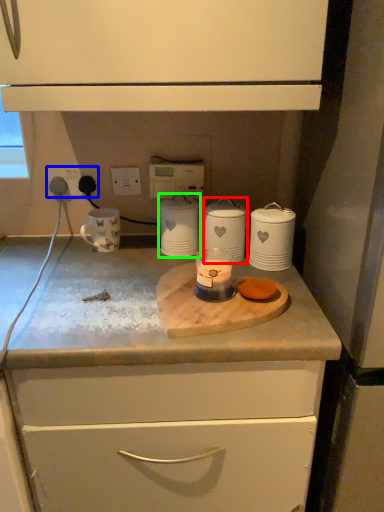
Question: Considering the real-world distances, which object is closest to home appliance (highlighted by a red box)? electric outlet (highlighted by a blue box) or home appliance (highlighted by a green box).

Choices:
 (A) electric outlet
 (B) home appliance

Answer: (B)